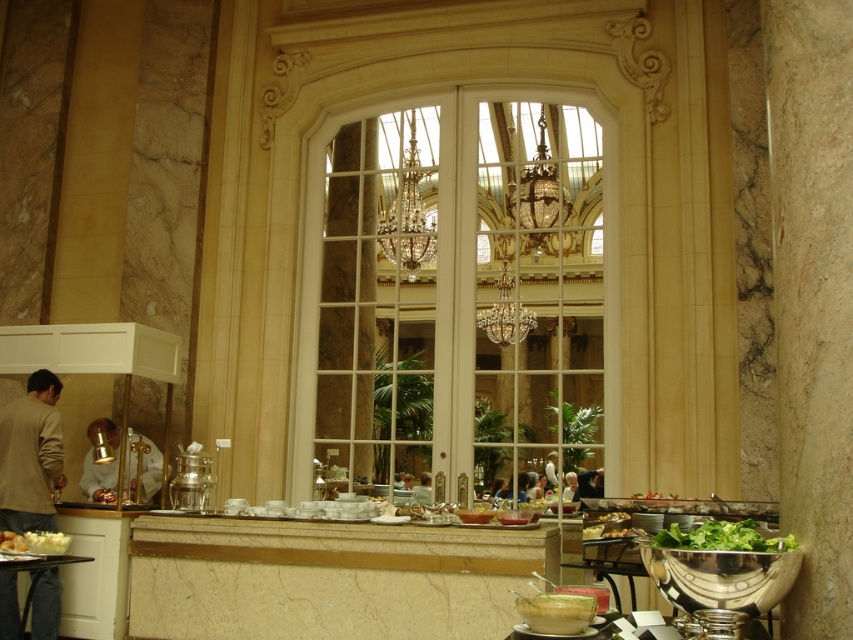
Which is more to the left, translucent glass bowl at lower center or white creamy mashed potatoes at lower left?

white creamy mashed potatoes at lower left is more to the left.

At what (x,y) coordinates should I click in order to perform the action: click on translucent glass bowl at lower center. Please return your answer as a coordinate pair (x, y). This screenshot has width=853, height=640. Looking at the image, I should click on (556, 612).

Can you confirm if green leafy salad at lower right is positioned above light brown leather jacket at center?

Correct, green leafy salad at lower right is located above light brown leather jacket at center.

Is point (786, 548) less distant than point (573, 472)?

Yes, point (786, 548) is in front of point (573, 472).

Image resolution: width=853 pixels, height=640 pixels. I want to click on green leafy salad at lower right, so click(723, 538).

Is gold metallic lamp at center below white fabric shirt at center?

No, gold metallic lamp at center is not below white fabric shirt at center.

Does gold metallic lamp at center have a greater height compared to white fabric shirt at center?

Yes.

What are the coordinates of `gold metallic lamp at center` in the screenshot? It's located at [100, 465].

Identify the location of gold metallic lamp at center. The image size is (853, 640). (100, 465).